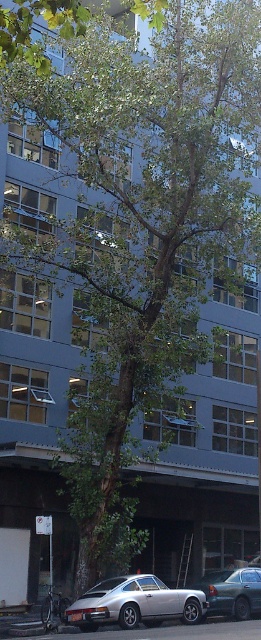
Measure the distance between point (169, 596) and camera.

The distance of point (169, 596) from camera is 61.39 feet.

Between silver metallic car at lower left and metallic gray sedan at center, which one is positioned lower?

Positioned lower is metallic gray sedan at center.

Identify the location of silver metallic car at lower left. (134, 604).